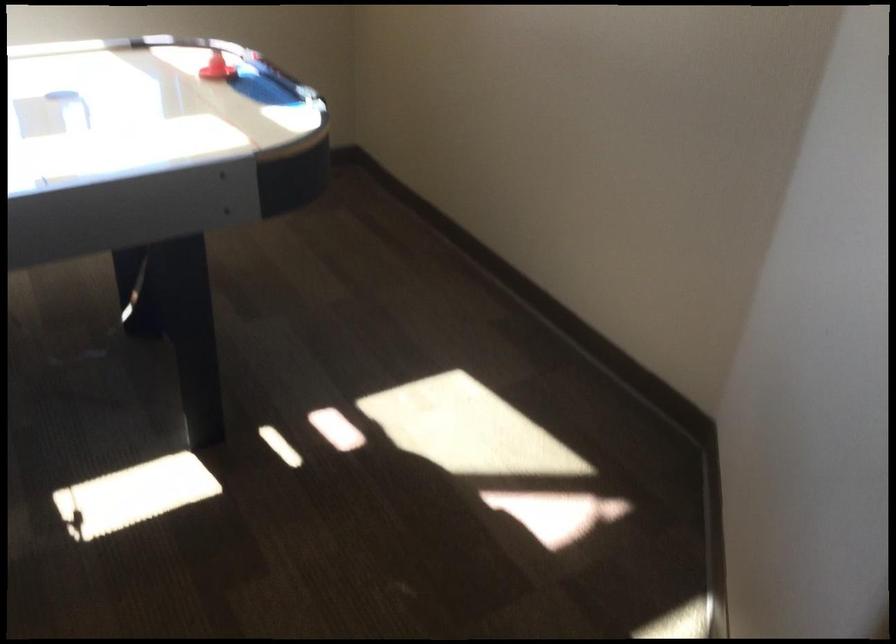
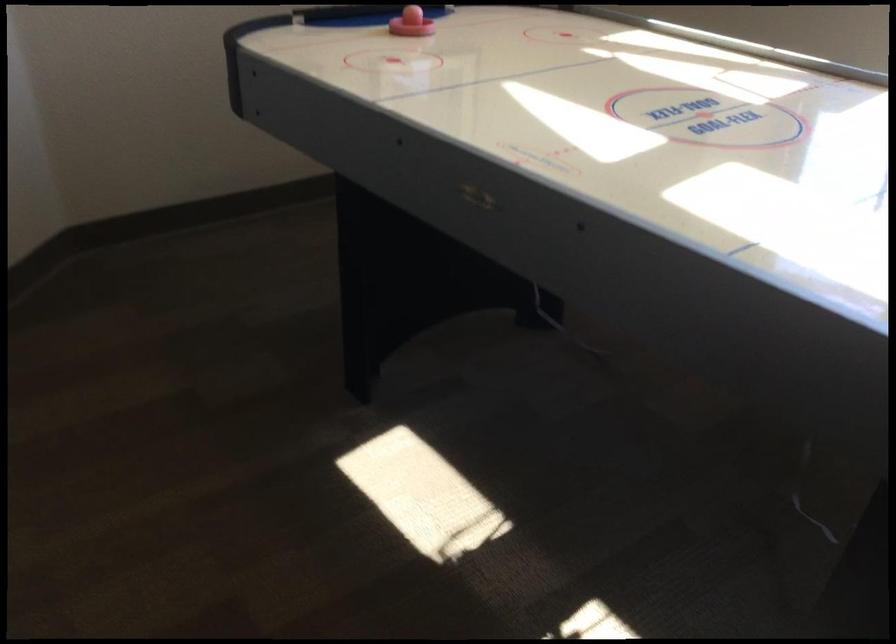
First-person continuous shooting, in which direction is the camera rotating?

The camera's rotation is toward left-down.